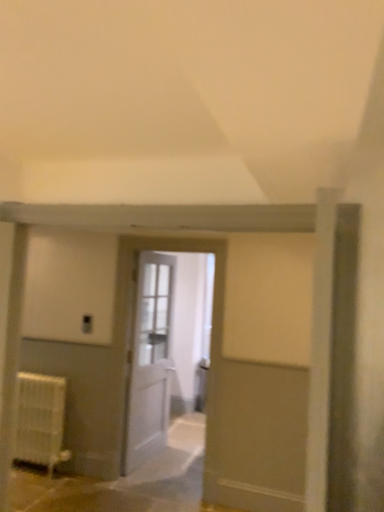
Question: Is white wooden door at center, acting as the 2th door starting from the front, surrounded by white matte radiator at lower left?

Choices:
 (A) yes
 (B) no

Answer: (B)

Question: From a real-world perspective, is white matte radiator at lower left positioned over white wooden door at center, which is the 1th door in back-to-front order, based on gravity?

Choices:
 (A) no
 (B) yes

Answer: (A)

Question: Can you confirm if white matte radiator at lower left is bigger than white wooden door at center, acting as the 2th door starting from the front?

Choices:
 (A) yes
 (B) no

Answer: (B)

Question: Is white matte radiator at lower left not inside white wooden door at center, acting as the 2th door starting from the front?

Choices:
 (A) no
 (B) yes

Answer: (B)

Question: Is white matte radiator at lower left closer to the viewer compared to white wooden door at center, acting as the 2th door starting from the front?

Choices:
 (A) no
 (B) yes

Answer: (B)

Question: Is white wooden door at center, acting as the 2th door starting from the front, bigger or smaller than white wooden door at center, which ranks as the first door in front-to-back order?

Choices:
 (A) small
 (B) big

Answer: (B)

Question: In the image, is white wooden door at center, acting as the 2th door starting from the front, positioned in front of or behind white wooden door at center, which is counted as the 2th door, starting from the back?

Choices:
 (A) front
 (B) behind

Answer: (B)

Question: Is white wooden door at center, acting as the 2th door starting from the front, wider or thinner than white wooden door at center, which is counted as the 2th door, starting from the back?

Choices:
 (A) wide
 (B) thin

Answer: (A)

Question: Is white wooden door at center, which is the 1th door in back-to-front order, inside the boundaries of white wooden door at center, which ranks as the first door in front-to-back order, or outside?

Choices:
 (A) outside
 (B) inside

Answer: (A)

Question: Looking at their shapes, would you say white matte radiator at lower left is wider or thinner than white wooden door at center, which ranks as the first door in front-to-back order?

Choices:
 (A) wide
 (B) thin

Answer: (A)

Question: From a real-world perspective, relative to white wooden door at center, which ranks as the first door in front-to-back order, is white matte radiator at lower left vertically above or below?

Choices:
 (A) above
 (B) below

Answer: (B)

Question: From the image's perspective, is white matte radiator at lower left located above or below white wooden door at center, which ranks as the first door in front-to-back order?

Choices:
 (A) above
 (B) below

Answer: (B)

Question: Would you say white matte radiator at lower left is inside or outside white wooden door at center, which is counted as the 2th door, starting from the back?

Choices:
 (A) inside
 (B) outside

Answer: (B)

Question: In the image, is white wooden door at center, which is counted as the 2th door, starting from the back, positioned in front of or behind white wooden door at center, acting as the 2th door starting from the front?

Choices:
 (A) behind
 (B) front

Answer: (B)

Question: From a real-world perspective, is white wooden door at center, which ranks as the first door in front-to-back order, positioned above or below white wooden door at center, which is the 1th door in back-to-front order?

Choices:
 (A) above
 (B) below

Answer: (A)